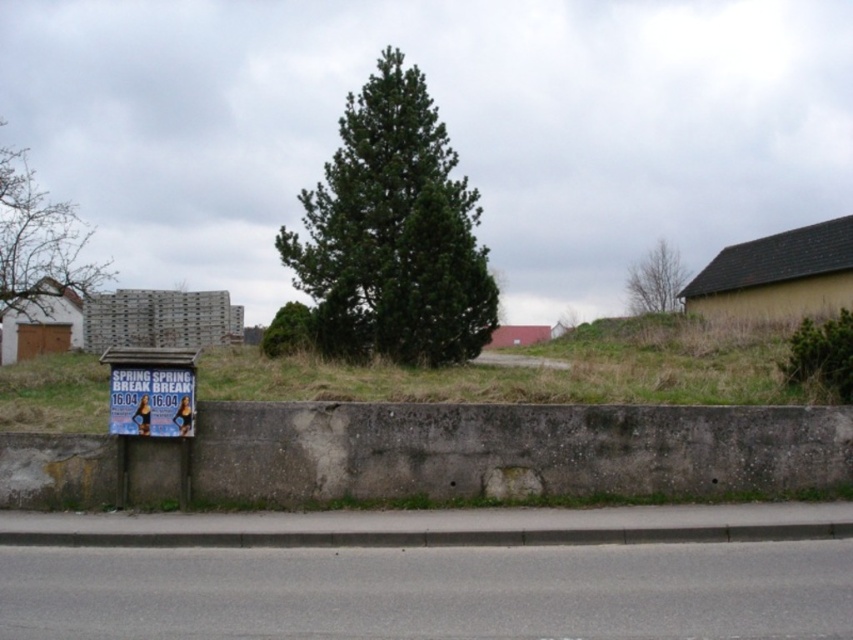
Between point (231, 540) and point (637, 282), which one is positioned in front?

Positioned in front is point (231, 540).

Is gray concrete curb at lower center smaller than green leafy tree at upper center?

Yes.

Describe the element at coordinates (432, 536) in the screenshot. The image size is (853, 640). I see `gray concrete curb at lower center` at that location.

You are a GUI agent. You are given a task and a screenshot of the screen. Output one action in this format:
    pyautogui.click(x=<x>, y=<y>)
    Task: Click on the gray concrete curb at lower center
    
    Given the screenshot: What is the action you would take?
    pyautogui.click(x=432, y=536)

Is green matte tree at center bigger than blue paper sign at lower left?

Indeed, green matte tree at center has a larger size compared to blue paper sign at lower left.

Is green matte tree at center further to the viewer compared to blue paper sign at lower left?

Yes.

Does point (428, 344) come closer to viewer compared to point (161, 404)?

No.

The width and height of the screenshot is (853, 640). Identify the location of green matte tree at center. (393, 234).

Who is more distant from viewer, (4, 266) or (671, 266)?

Point (671, 266)

Find the location of a particular element. The width and height of the screenshot is (853, 640). green leafy tree at left is located at coordinates (39, 250).